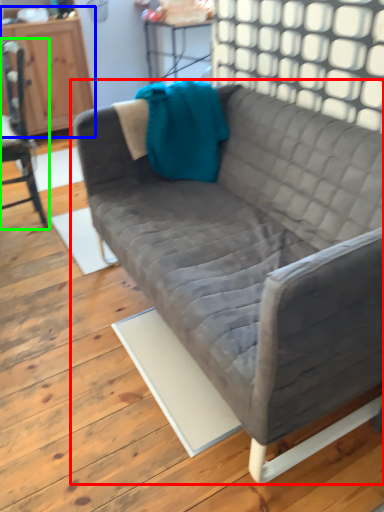
Question: Which object is positioned closest to studio couch (highlighted by a red box)? Select from dresser (highlighted by a blue box) and chair (highlighted by a green box).

Choices:
 (A) dresser
 (B) chair

Answer: (B)